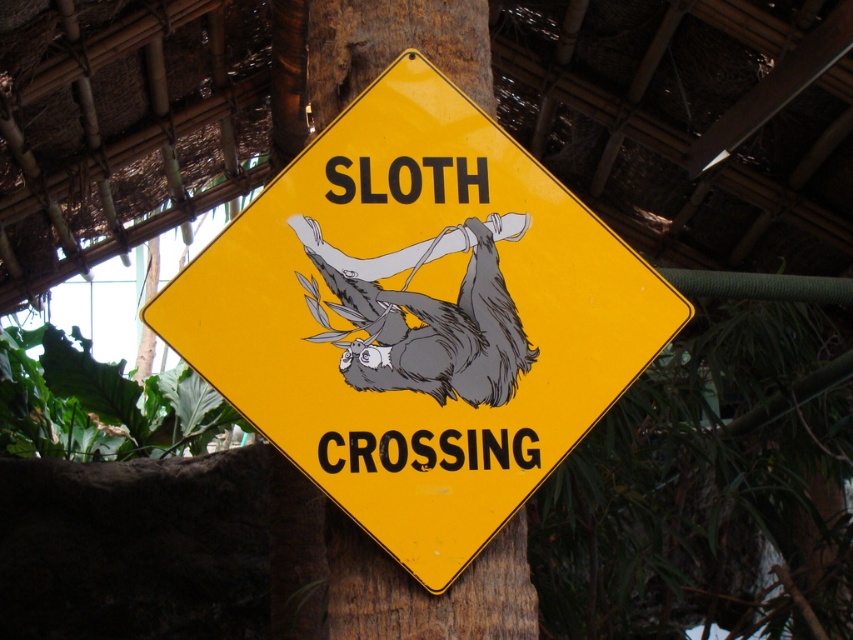
Question: Which point is closer to the camera?

Choices:
 (A) (502, 285)
 (B) (450, 534)

Answer: (B)

Question: Does yellow matte sign at center have a larger size compared to gray matte sloth at center?

Choices:
 (A) no
 (B) yes

Answer: (B)

Question: Can you confirm if yellow matte sign at center is thinner than gray matte sloth at center?

Choices:
 (A) yes
 (B) no

Answer: (B)

Question: Which point is closer to the camera taking this photo?

Choices:
 (A) (393, 376)
 (B) (520, 458)

Answer: (A)

Question: Is yellow matte sign at center smaller than gray matte sloth at center?

Choices:
 (A) yes
 (B) no

Answer: (B)